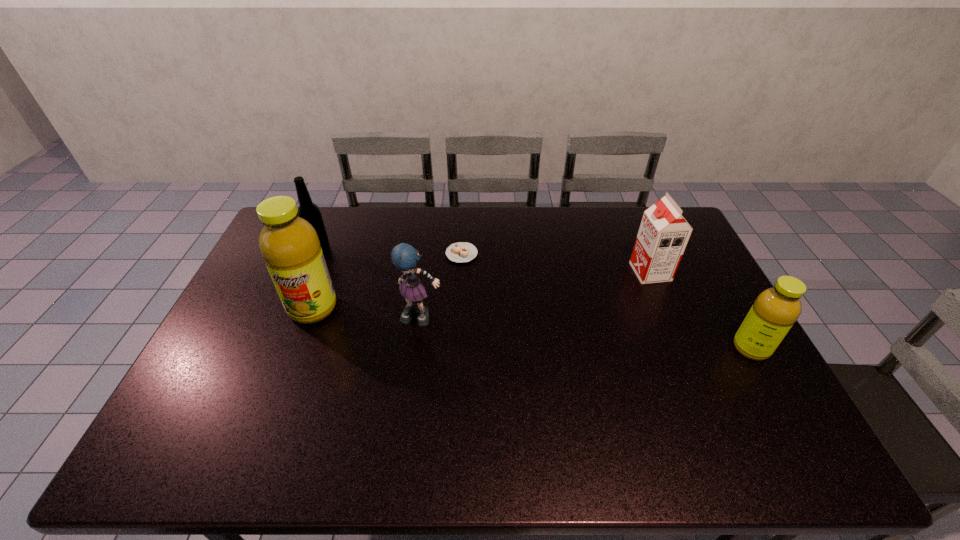
If equal spacing is the goal by inserting an additional fruit_juice among them, please point out a vacant space for this new fruit_juice. Please provide its 2D coordinates. Your answer should be formatted as a tuple, i.e. [(x, y)], where the tuple contains the x and y coordinates of a point satisfying the conditions above.

[(522, 327)]